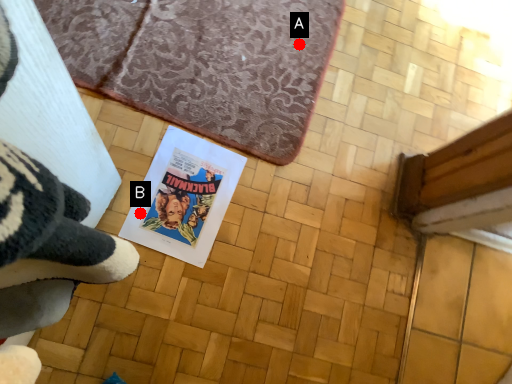
Question: Two points are circled on the image, labeled by A and B beside each circle. Which point appears closest to the camera in this image?

Choices:
 (A) A is closer
 (B) B is closer

Answer: (B)